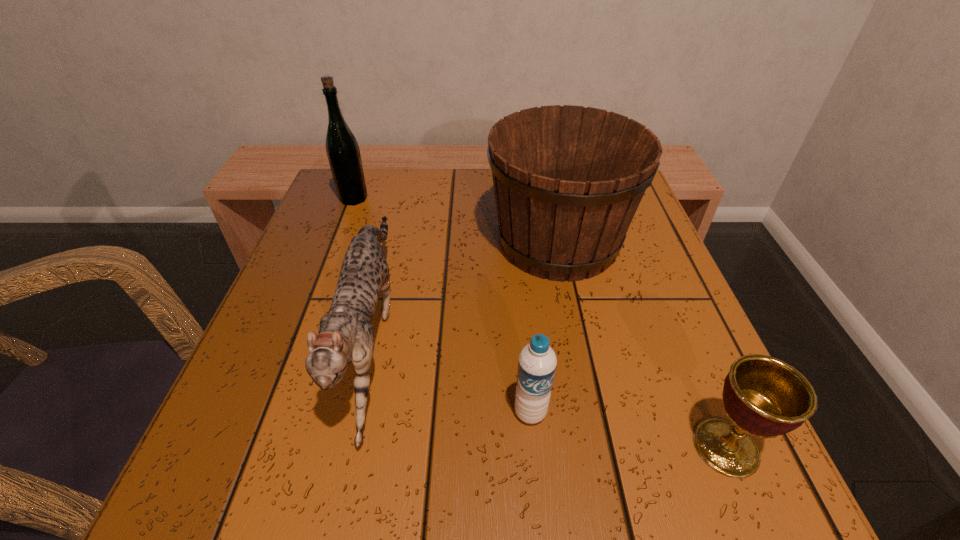
Find the location of a particular element. object that is positioned at the far right corner is located at coordinates (568, 180).

I want to click on object located at the near right corner, so click(x=764, y=397).

Locate an element on the screen. The height and width of the screenshot is (540, 960). blank space at the far edge is located at coordinates (434, 181).

The width and height of the screenshot is (960, 540). In the image, there is a desktop. Identify the location of free space at the near edge. (609, 470).

I want to click on vacant region at the left edge of the desktop, so click(x=305, y=233).

You are a GUI agent. You are given a task and a screenshot of the screen. Output one action in this format:
    pyautogui.click(x=<x>, y=<y>)
    Task: Click on the vacant position at the right edge of the desktop
    The height and width of the screenshot is (540, 960).
    Given the screenshot: What is the action you would take?
    pyautogui.click(x=636, y=239)

Image resolution: width=960 pixels, height=540 pixels. In the image, there is a desktop. Find the location of `vacant space at the far left corner`. vacant space at the far left corner is located at coordinates (332, 221).

Locate an element on the screen. The width and height of the screenshot is (960, 540). vacant space in between the water bottle and the cat is located at coordinates (451, 372).

At what (x,y) coordinates should I click in order to perform the action: click on free space between the fourth object from right to left and the wine bucket. Please return your answer as a coordinate pair (x, y). This screenshot has width=960, height=540. Looking at the image, I should click on (465, 287).

The width and height of the screenshot is (960, 540). Identify the location of vacant space in between the wine bucket and the leftmost object. (456, 221).